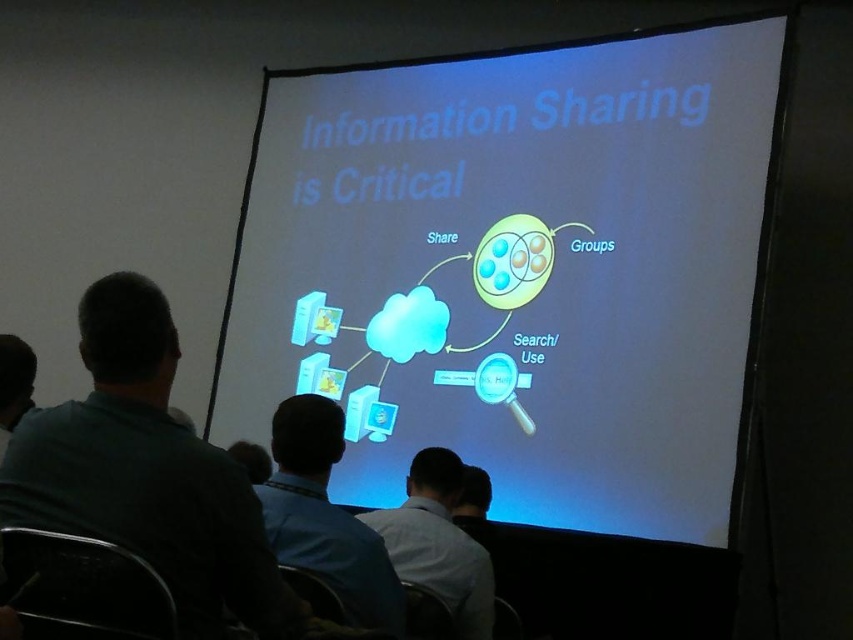
Question: Which of the following is the closest to the observer?

Choices:
 (A) green fabric shirt at left
 (B) gray shirt at lower center
 (C) white glossy projector screen at center

Answer: (A)

Question: Is white glossy projector screen at center behind green fabric shirt at left?

Choices:
 (A) yes
 (B) no

Answer: (A)

Question: Where is blue shirt at center located in relation to gray shirt at lower center in the image?

Choices:
 (A) right
 (B) left

Answer: (B)

Question: Among these objects, which one is nearest to the camera?

Choices:
 (A) blue shirt at center
 (B) gray shirt at lower center
 (C) white glossy projector screen at center
 (D) green fabric shirt at left

Answer: (D)

Question: Among these points, which one is farthest from the camera?

Choices:
 (A) click(196, 561)
 (B) click(386, 356)

Answer: (B)

Question: Is green fabric shirt at left closer to camera compared to gray shirt at lower center?

Choices:
 (A) no
 (B) yes

Answer: (B)